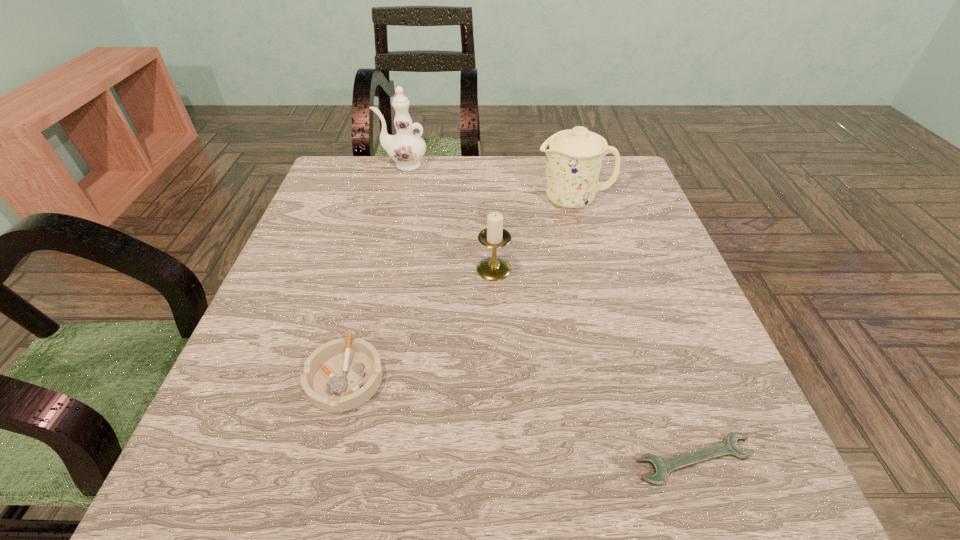
Where is `free space at the right edge of the desktop`? Image resolution: width=960 pixels, height=540 pixels. free space at the right edge of the desktop is located at coordinates (656, 251).

Locate an element on the screen. vacant space at the far left corner of the desktop is located at coordinates (349, 200).

Find the location of a particular element. The image size is (960, 540). vacant space at the near left corner is located at coordinates (252, 468).

This screenshot has height=540, width=960. In the image, there is a desktop. In order to click on vacant space at the near right corner in this screenshot , I will do `click(754, 500)`.

In order to click on blank region between the third object from right to left and the farthest object in this screenshot , I will do coord(448,217).

Find the location of `empty location between the nearer chinaware and the third object from right to left`. empty location between the nearer chinaware and the third object from right to left is located at coordinates (534, 234).

Where is `unoccupied area between the shortest object and the fourth nearest object`? The image size is (960, 540). unoccupied area between the shortest object and the fourth nearest object is located at coordinates (634, 330).

Identify the location of free area in between the third nearest object and the ashtray. (420, 323).

Identify the location of empty location between the fourth nearest object and the nearest object. The image size is (960, 540). (634, 330).

Find the location of a particular element. The height and width of the screenshot is (540, 960). vacant region between the shortest object and the farther chinaware is located at coordinates (549, 312).